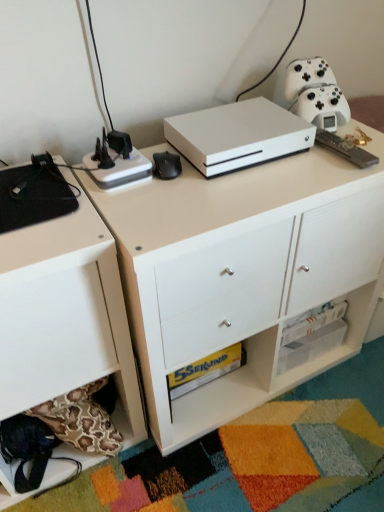
Question: From a real-world perspective, is white matte xbox one s at center above or below white matte chest of drawers at lower left?

Choices:
 (A) above
 (B) below

Answer: (A)

Question: Is point (253, 325) positioned closer to the camera than point (36, 229)?

Choices:
 (A) closer
 (B) farther

Answer: (B)

Question: Which of these objects is positioned farthest from the black matte mouse pad at left, marked as the fourth appliance in a right-to-left arrangement?

Choices:
 (A) black plastic power strip at upper left, the second appliance when ordered from left to right
 (B) white matte gaming console at center, which ranks as the 3th appliance in left-to-right order
 (C) white matte game controller at upper right, which ranks as the 1th appliance in right-to-left order
 (D) white matte xbox one s at center
 (E) white matte chest of drawers at lower left

Answer: (C)

Question: Which object is positioned farthest from the black plastic power strip at upper left, which is the 3th appliance from right to left?

Choices:
 (A) white matte game controller at upper right, which ranks as the 1th appliance in right-to-left order
 (B) white matte gaming console at center, which ranks as the 3th appliance in left-to-right order
 (C) white matte xbox one s at center
 (D) black matte mouse pad at left, marked as the fourth appliance in a right-to-left arrangement
 (E) white matte chest of drawers at lower left

Answer: (A)